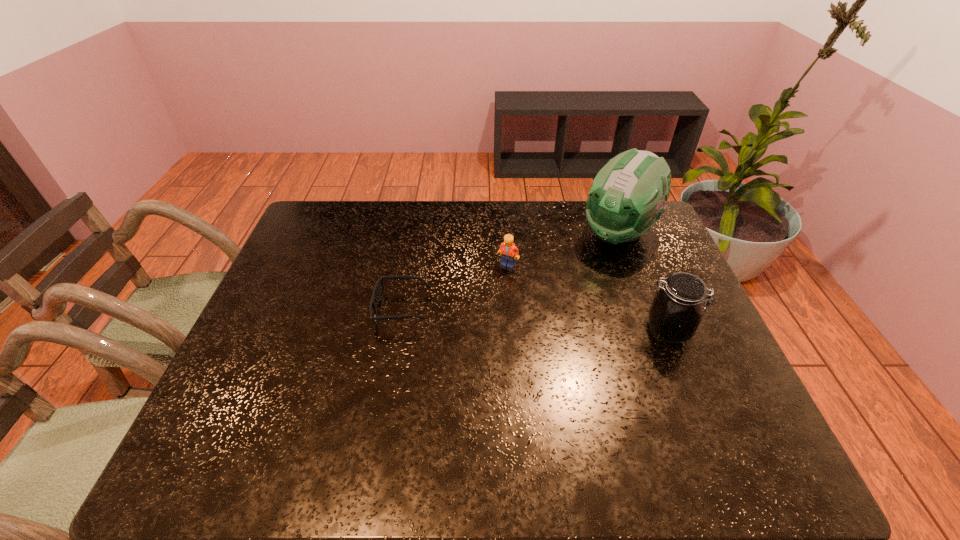
The height and width of the screenshot is (540, 960). Identify the location of vacant space at the near edge. (484, 413).

This screenshot has width=960, height=540. In the image, there is a desktop. What are the coordinates of `vacant space at the left edge` in the screenshot? It's located at (273, 330).

I want to click on free location at the far left corner, so click(352, 201).

At what (x,y) coordinates should I click in order to perform the action: click on free space between the sunglasses and the second shortest object. Please return your answer as a coordinate pair (x, y). Looking at the image, I should click on (455, 287).

This screenshot has height=540, width=960. Find the location of `free space between the tallest object and the jar`. free space between the tallest object and the jar is located at coordinates (643, 282).

Locate an element on the screen. This screenshot has width=960, height=540. vacant space that is in between the football helmet and the third object from right to left is located at coordinates (564, 249).

This screenshot has height=540, width=960. Identify the location of free space between the sunglasses and the jar. (535, 320).

The image size is (960, 540). Find the location of `free point between the shortest object and the football helmet`. free point between the shortest object and the football helmet is located at coordinates (510, 271).

Find the location of a particular element. The height and width of the screenshot is (540, 960). unoccupied position between the Lego and the jar is located at coordinates (x=588, y=298).

Locate an element on the screen. vacant space that's between the second tallest object and the football helmet is located at coordinates (643, 282).